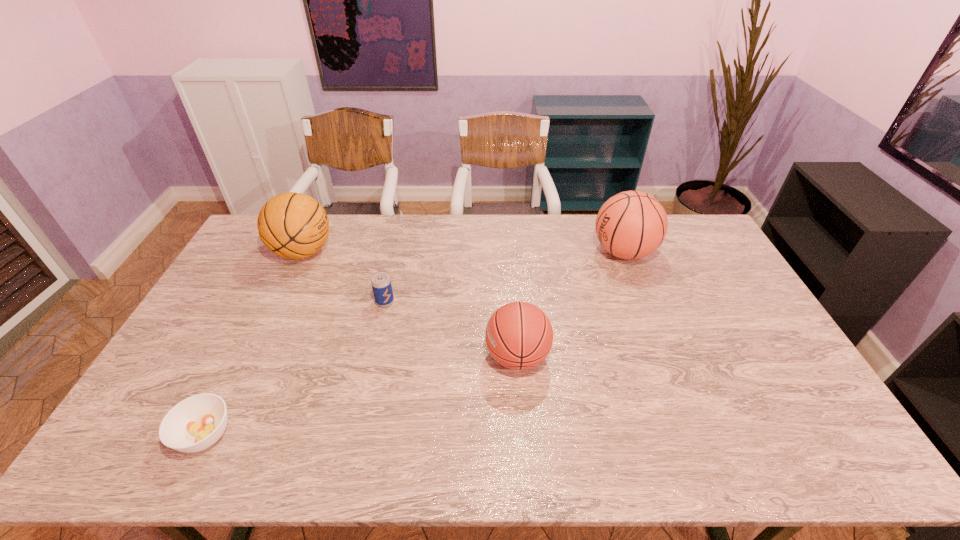
The height and width of the screenshot is (540, 960). Find the location of `the rightmost object`. the rightmost object is located at coordinates [x=631, y=225].

Locate an element on the screen. The height and width of the screenshot is (540, 960). the leftmost basketball is located at coordinates (293, 225).

This screenshot has width=960, height=540. What are the coordinates of `the third tallest object` in the screenshot? It's located at (519, 336).

Where is `the nearest basketball`? The width and height of the screenshot is (960, 540). the nearest basketball is located at coordinates 519,336.

The image size is (960, 540). What are the coordinates of `the fourth tallest object` in the screenshot? It's located at (381, 284).

The height and width of the screenshot is (540, 960). I want to click on the third nearest object, so click(381, 284).

Where is `the shortest object`? the shortest object is located at coordinates (196, 423).

Locate an element on the screen. soup bowl is located at coordinates (196, 423).

This screenshot has height=540, width=960. I want to click on vacant region located 0.060m on the surface of the rightmost object near the brand logo, so click(x=575, y=252).

You are a GUI agent. You are given a task and a screenshot of the screen. Output one action in this format:
    pyautogui.click(x=<x>, y=<y>)
    Task: Click on the vacant area situated 0.070m on the surface of the rightmost object near the brand logo
    
    Given the screenshot: What is the action you would take?
    pyautogui.click(x=572, y=252)